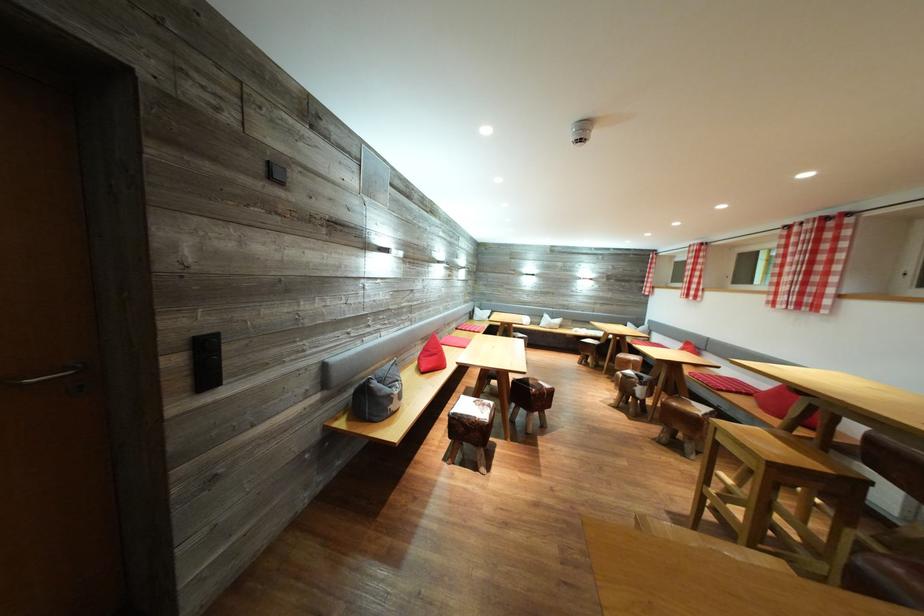
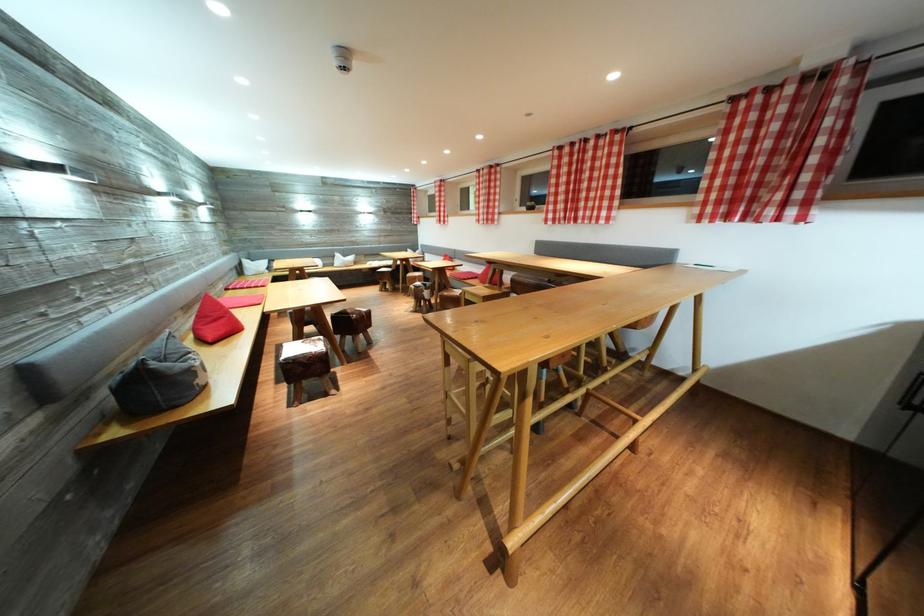
Find the pixel in the second image that matches (481,323) in the first image.

(254, 278)